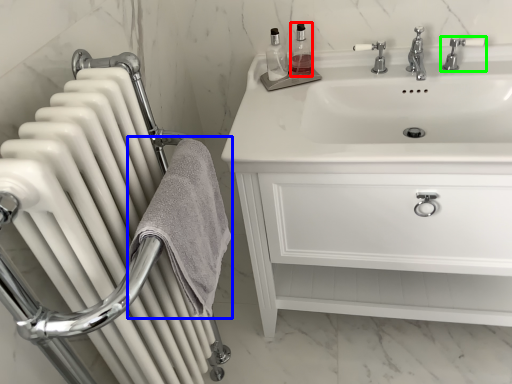
Question: Estimate the real-world distances between objects in this image. Which object is farther from soap dispenser (highlighted by a red box), bath towel (highlighted by a blue box) or tap (highlighted by a green box)?

Choices:
 (A) bath towel
 (B) tap

Answer: (A)